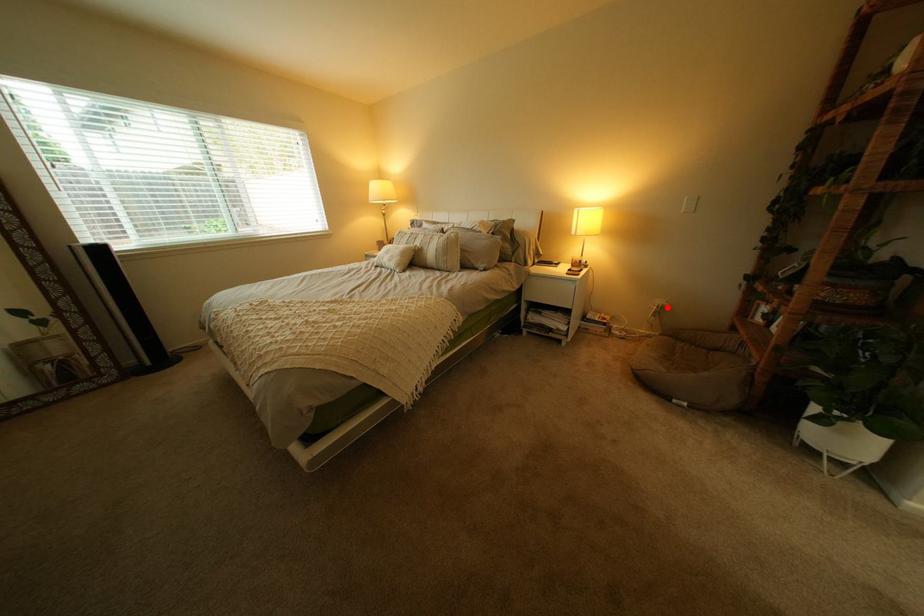
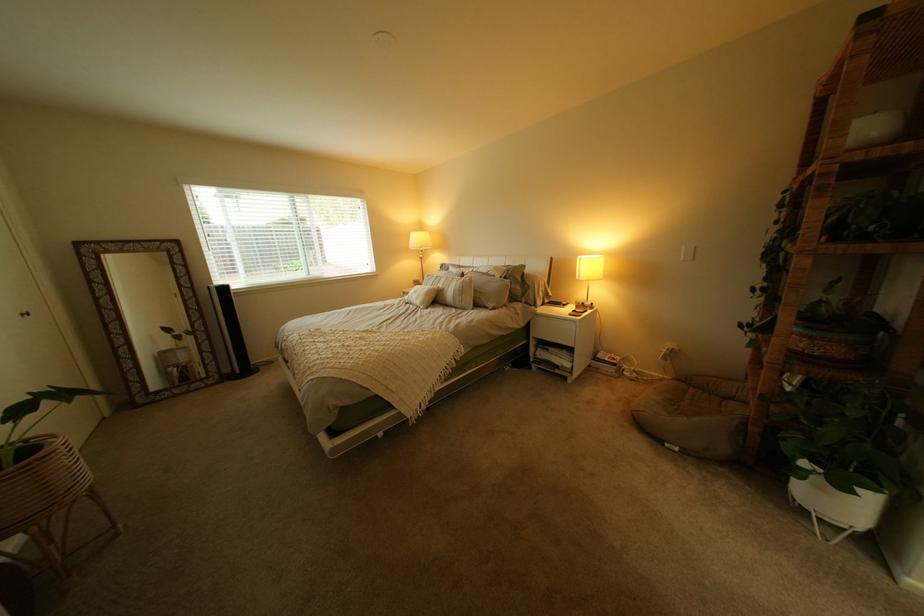
In the second image, find the point that corresponds to the highlighted location in the first image.

(677, 350)